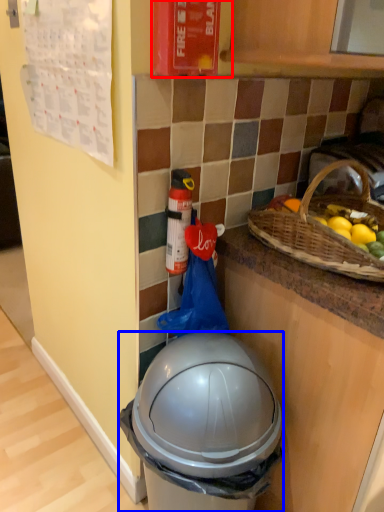
Question: Which of the following is the closest to the observer, fire extinguisher (highlighted by a red box) or trash bin/can (highlighted by a blue box)?

Choices:
 (A) fire extinguisher
 (B) trash bin/can

Answer: (B)